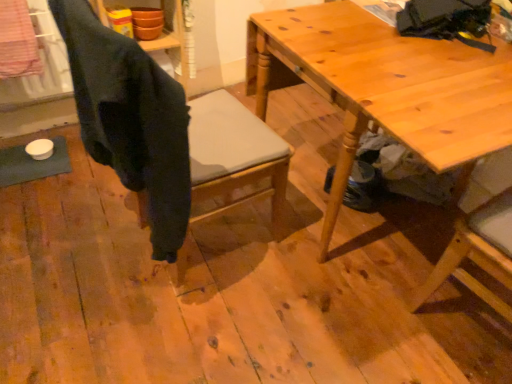
Locate an element on the screen. Image resolution: width=512 pixels, height=384 pixels. vacant area to the right of dark gray fabric chair at center is located at coordinates coord(282,273).